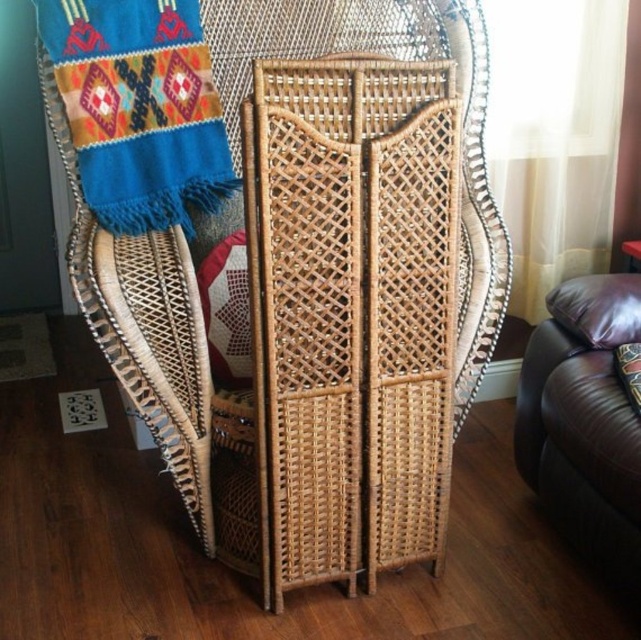
You are a person who is 1.8 meters tall. You are standing in the room and want to pick up the woven woolen scarf at upper left from the brown leather couch at lower right. Can you reach the scarf without moving the couch or the scarf?

The distance between the woven woolen scarf at upper left and the brown leather couch at lower right is 1.11 meters. Since you are 1.8 meters tall, your arms can reach approximately 1.2 meters in front of you. Therefore, you can reach the scarf from the couch without moving either item.